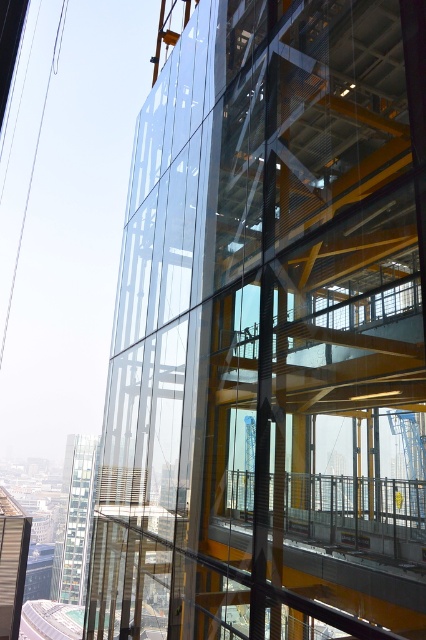
You are an architect reviewing the construction site. You notice two towers in the image. Which one is larger in size? Please refer to the glassy transparent tower at lower left and the metallic glass tower at center for your answer.

The glassy transparent tower at lower left is bigger than the metallic glass tower at center, so the glassy transparent tower at lower left is larger in size.

You are standing at the construction site and see two points marked in the image. The first point is at coordinate point (51,589) and the second is at point (5,614). Which point is closer to you?

Point (5,614) is closer to you because it is in front of point (51,589).

You are an architect inspecting a construction site. You notice the glassy transparent tower at lower left and the metallic glass tower at center. Which tower is located below the other?

The glassy transparent tower at lower left is positioned under the metallic glass tower at center, meaning it is located below the metallic glass tower at center.